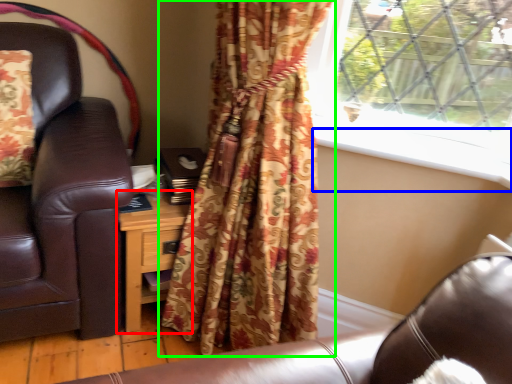
Question: Which object is positioned closest to nightstand (highlighted by a red box)? Select from window sill (highlighted by a blue box) and curtain (highlighted by a green box).

Choices:
 (A) window sill
 (B) curtain

Answer: (B)